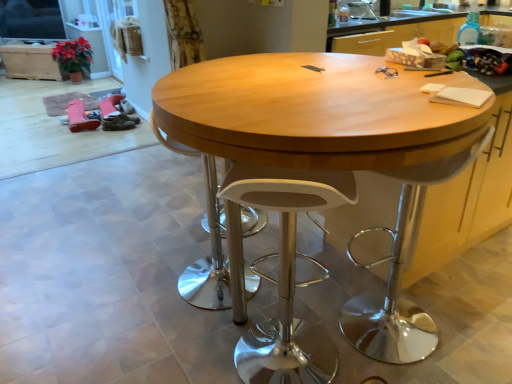
This screenshot has height=384, width=512. What are the coordinates of `free area in between wooden table at center and white plastic stool at center` in the screenshot? It's located at (185, 338).